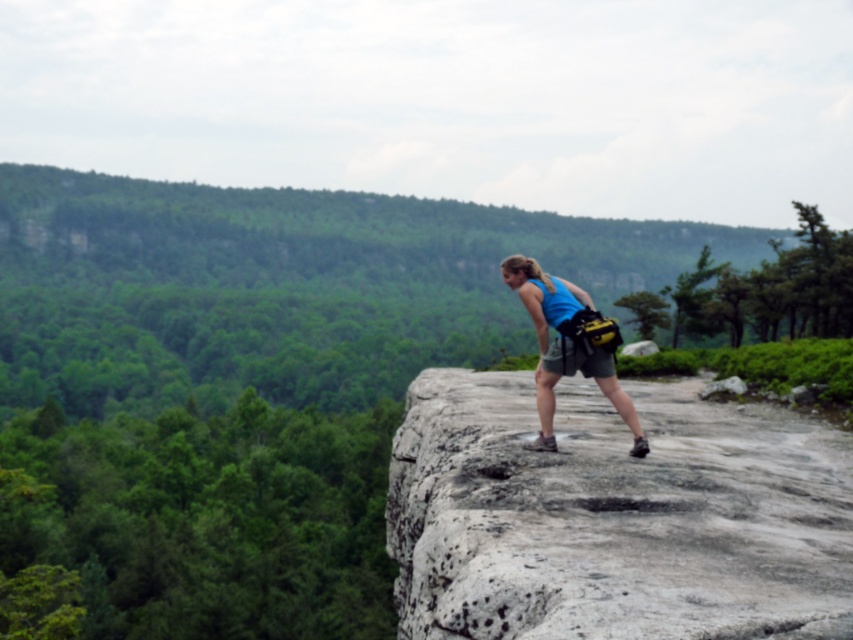
You are a hiker who wants to place your blue fabric tank top at center on the gray rough rock at center. Can you determine if the rock is wide enough to hold the tank top?

The gray rough rock at center might be wider than blue fabric tank top at center, so it is possible that the rock can accommodate the tank top. However, there is uncertainty in the comparison.

Based on the photo, you are a hiker who has just reached the cliff edge. You see the gray rough rock at center and the blue fabric tank top at center. Which object is closer to you as you stand at the cliff edge?

The gray rough rock at center is closer to you because it is positioned in front of the blue fabric tank top at center.

You are a hiker who wants to place your backpack on a stable surface. The gray rough rock at center is located at coordinates point 0.806, 0.721. Can you confirm if this rock is suitable for placing your backpack?

The gray rough rock at center is located at coordinates point (614,515). Since the rock is described as rough and positioned at those coordinates, it might not be a flat surface, so placing the backpack there could be unstable. Look for a flatter rock nearby.